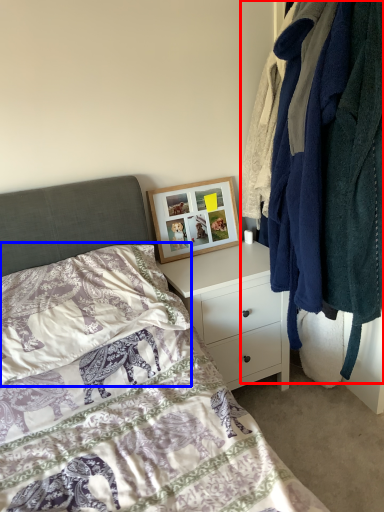
Question: Which point is further to the camera, closet (highlighted by a red box) or pillow (highlighted by a blue box)?

Choices:
 (A) closet
 (B) pillow

Answer: (B)